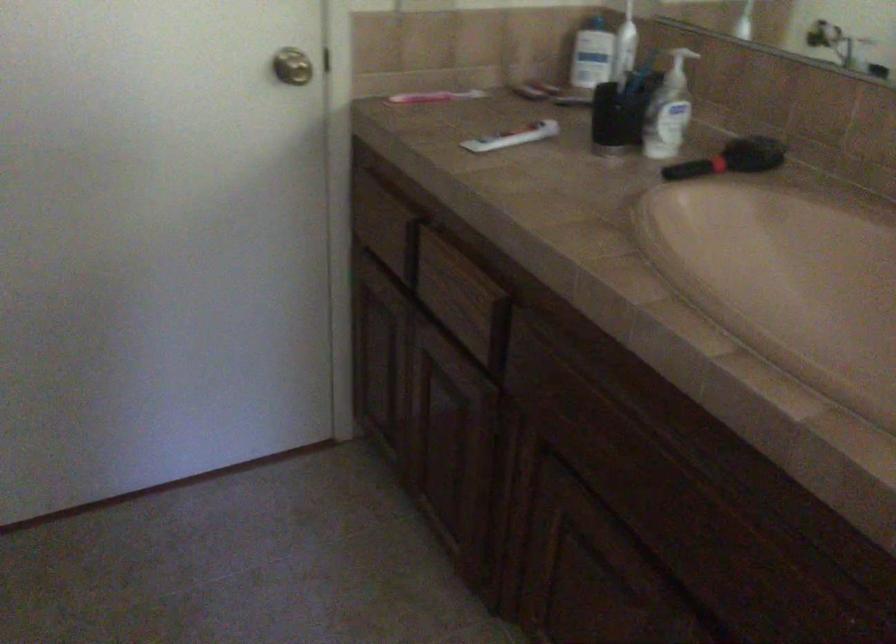
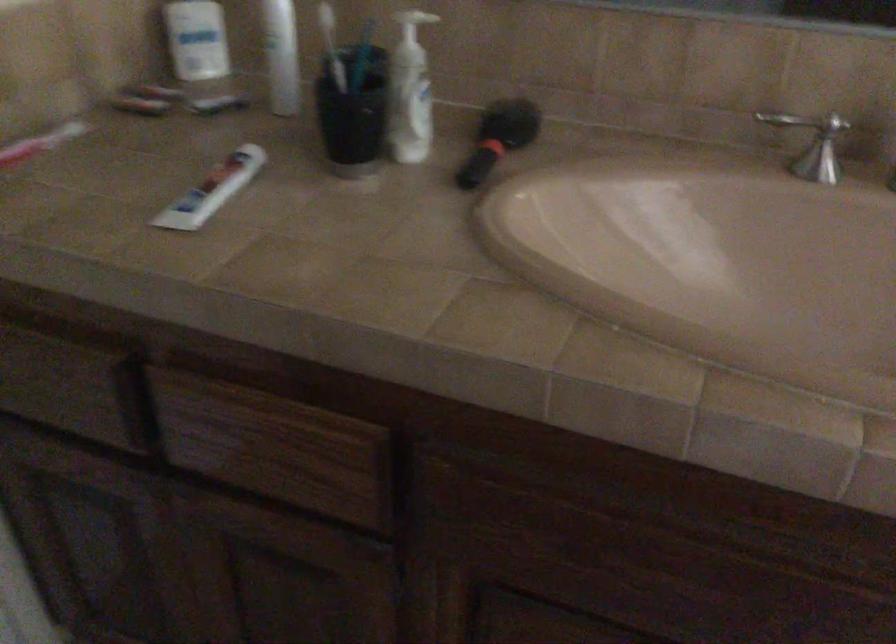
In the second image, find the point that corresponds to point 607,105 in the first image.

(352, 113)